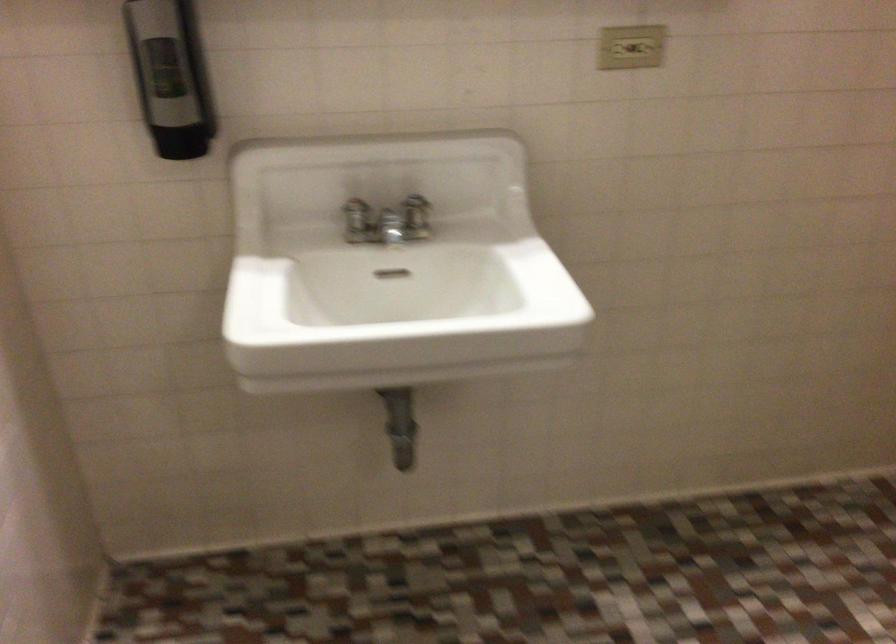
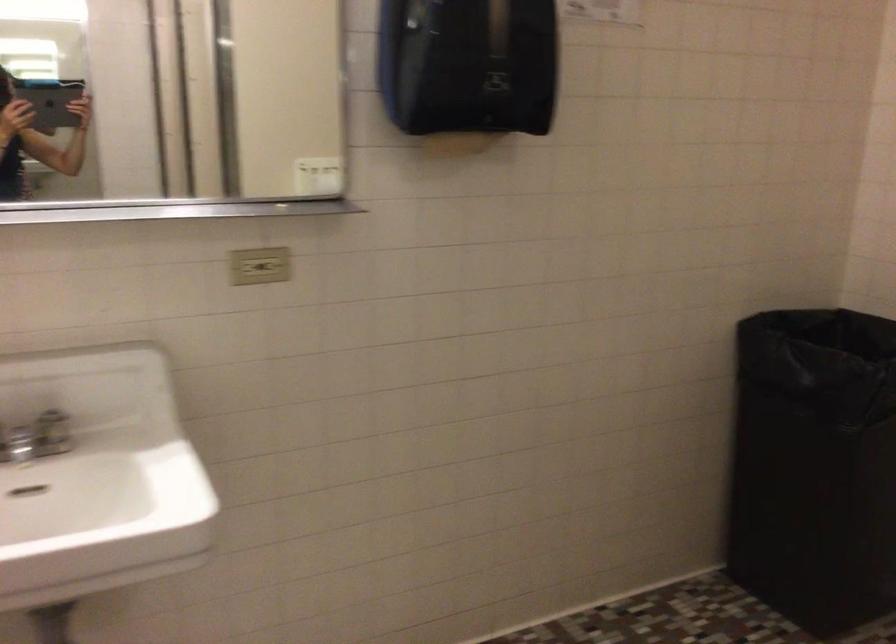
Question: The images are taken continuously from a first-person perspective. In which direction is your viewpoint rotating?

Choices:
 (A) Left
 (B) Right
 (C) Up
 (D) Down

Answer: (B)